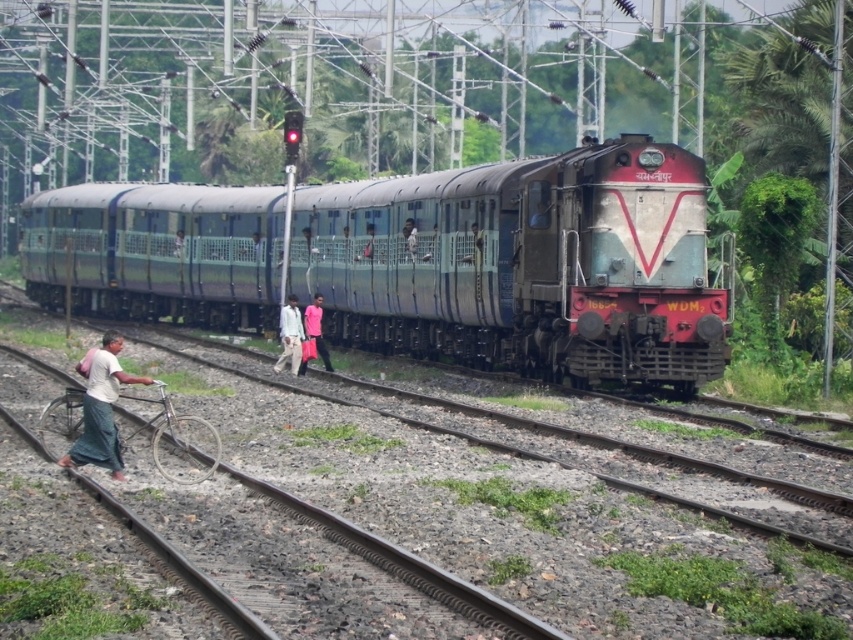
You are standing at the railway station and see two points marked on the ground. The first point is at coordinates point (102, 365) and the second point is at point (286, 324). Which point is closer to you?

Point (102, 365) is closer to the viewer than point (286, 324).

You are a photographer at the railway station. You want to take a photo of the train and the three people walking along the tracks. When you look through your camera, which of the objects, the white fabric shirt at lower left or the light brown fabric pants at center, will appear closer to you in the photo?

The white fabric shirt at lower left will appear closer to you in the photo because it is in front of the light brown fabric pants at center.

You are observing a railway station scene with a train and people near the tracks. You notice two individuals wearing pants made of fabric. One has light brown fabric pants at center and the other has light blue fabric pants at center. Which of these two pairs of pants is shorter in length?

The light brown fabric pants at center is shorter than the light blue fabric pants at center.